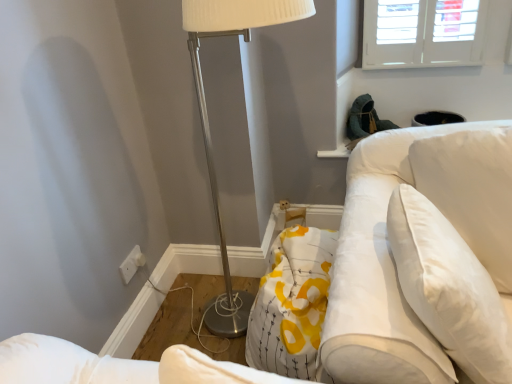
Question: Considering the relative positions of white plastic electric outlet at lower left and white fabric swivel chair at right in the image provided, is white plastic electric outlet at lower left to the right of white fabric swivel chair at right from the viewer's perspective?

Choices:
 (A) yes
 (B) no

Answer: (B)

Question: From the image's perspective, is white plastic electric outlet at lower left located above white fabric swivel chair at right?

Choices:
 (A) no
 (B) yes

Answer: (A)

Question: Can you confirm if white plastic electric outlet at lower left is shorter than white fabric swivel chair at right?

Choices:
 (A) yes
 (B) no

Answer: (A)

Question: From a real-world perspective, does white plastic electric outlet at lower left stand above white fabric swivel chair at right?

Choices:
 (A) no
 (B) yes

Answer: (A)

Question: Could you tell me if white plastic electric outlet at lower left is facing white fabric swivel chair at right?

Choices:
 (A) yes
 (B) no

Answer: (A)

Question: Can we say white plastic electric outlet at lower left lies outside white fabric swivel chair at right?

Choices:
 (A) yes
 (B) no

Answer: (A)

Question: From a real-world perspective, is white fabric swivel chair at right located higher than white soft pillow at upper right?

Choices:
 (A) yes
 (B) no

Answer: (A)

Question: Is white fabric swivel chair at right shorter than white soft pillow at upper right?

Choices:
 (A) yes
 (B) no

Answer: (B)

Question: Is white fabric swivel chair at right positioned with its back to white soft pillow at upper right?

Choices:
 (A) no
 (B) yes

Answer: (A)

Question: From a real-world perspective, does white fabric swivel chair at right sit lower than white soft pillow at upper right?

Choices:
 (A) yes
 (B) no

Answer: (B)

Question: Considering the relative sizes of white fabric swivel chair at right and white soft pillow at upper right in the image provided, is white fabric swivel chair at right smaller than white soft pillow at upper right?

Choices:
 (A) yes
 (B) no

Answer: (B)

Question: Does white fabric swivel chair at right come behind white soft pillow at upper right?

Choices:
 (A) yes
 (B) no

Answer: (A)

Question: From a real-world perspective, does metallic silver floor lamp at center sit lower than white fabric swivel chair at right?

Choices:
 (A) no
 (B) yes

Answer: (A)